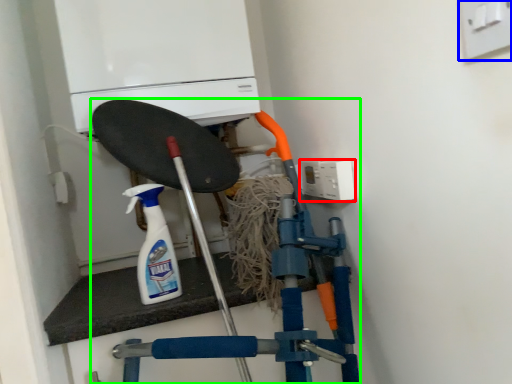
Question: Based on their relative distances, which object is nearer to electric outlet (highlighted by a red box)? Choose from electric outlet (highlighted by a blue box) and vacuum (highlighted by a green box).

Choices:
 (A) electric outlet
 (B) vacuum

Answer: (B)